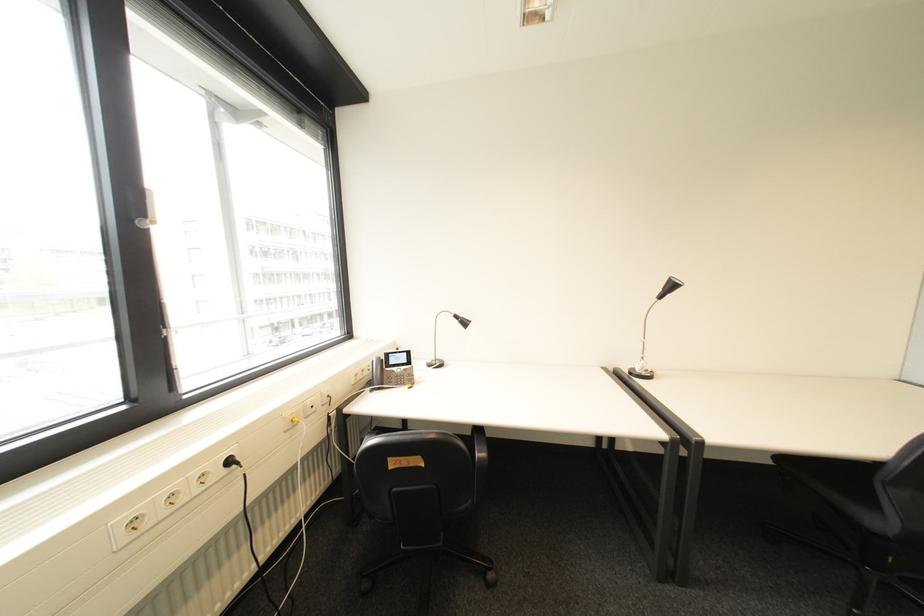
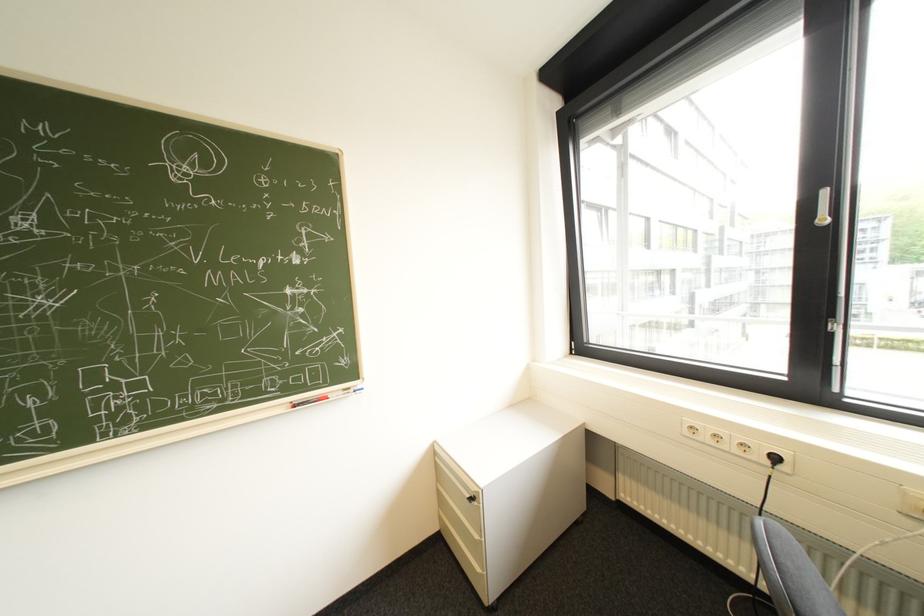
Where in the second image is the point corresponding to (x=235, y=472) from the first image?

(779, 463)